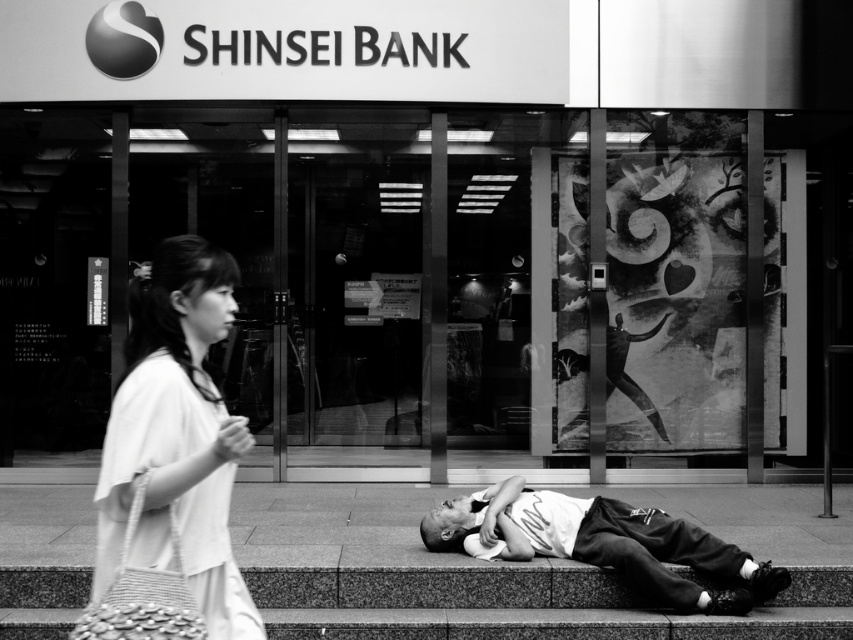
Is granite pavement at lower center positioned before white fabric bag at left?

No, it is behind white fabric bag at left.

Is granite pavement at lower center wider than white fabric bag at left?

Correct, the width of granite pavement at lower center exceeds that of white fabric bag at left.

Identify the location of granite pavement at lower center. (518, 566).

Is granite pavement at lower center thinner than white cotton shirt at lower center?

Incorrect, granite pavement at lower center's width is not less than white cotton shirt at lower center's.

Based on the photo, who is positioned more to the right, granite pavement at lower center or white cotton shirt at lower center?

white cotton shirt at lower center

Is point (265, 554) positioned behind point (426, 547)?

That is True.

I want to click on granite pavement at lower center, so click(x=518, y=566).

Who is more distant from viewer, (222, 509) or (666, 525)?

The point (666, 525) is more distant.

Is point (126, 515) positioned in front of point (657, 576)?

Yes, point (126, 515) is closer to viewer.

Image resolution: width=853 pixels, height=640 pixels. What do you see at coordinates (177, 436) in the screenshot? I see `white fabric bag at left` at bounding box center [177, 436].

I want to click on white fabric bag at left, so click(x=177, y=436).